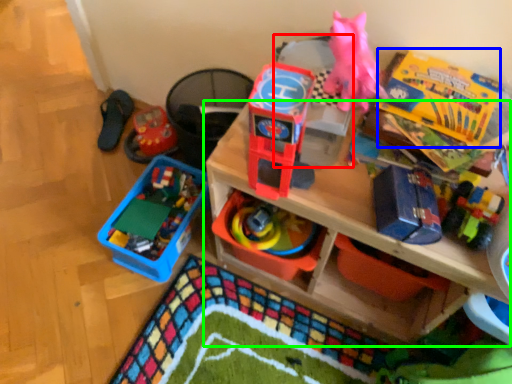
Question: Based on their relative distances, which object is nearer to storage box (highlighted by a red box)? Choose from storage box (highlighted by a blue box) and shelf (highlighted by a green box).

Choices:
 (A) storage box
 (B) shelf

Answer: (A)